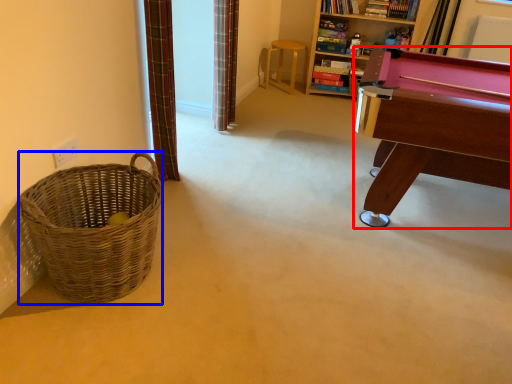
Question: Which point is further to the camera, table (highlighted by a red box) or basket (highlighted by a blue box)?

Choices:
 (A) table
 (B) basket

Answer: (A)